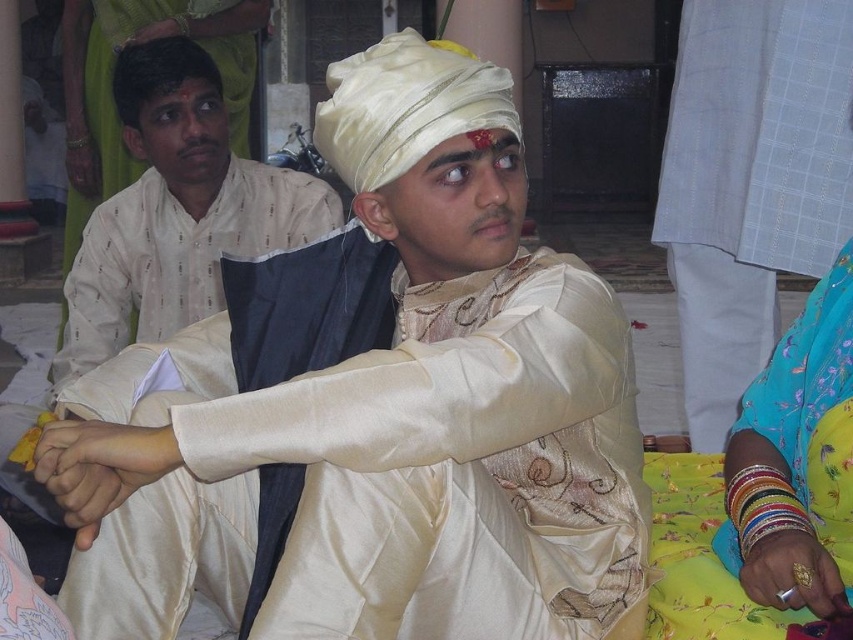
Which of these two, satin beige turban at center or multicolored bangles at lower right, stands shorter?

A: multicolored bangles at lower right

Does point (460, 236) come closer to viewer compared to point (786, 420)?

Yes, point (460, 236) is closer to viewer.

This screenshot has width=853, height=640. Identify the location of satin beige turban at center. (373, 410).

Does matte beige kurta at left have a lesser width compared to reddish-brown paste at forehead center?

Incorrect, matte beige kurta at left's width is not less than reddish-brown paste at forehead center's.

Is matte beige kurta at left to the left of reddish-brown paste at forehead center from the viewer's perspective?

Yes, matte beige kurta at left is to the left of reddish-brown paste at forehead center.

Describe the element at coordinates (161, 92) in the screenshot. I see `matte beige kurta at left` at that location.

In order to click on matte beige kurta at left in this screenshot , I will do `click(161, 92)`.

Measure the distance from satin beige turban at center to matte beige kurta at left.

satin beige turban at center is 6.45 feet from matte beige kurta at left.

Is satin beige turban at center thinner than matte beige kurta at left?

Incorrect, satin beige turban at center's width is not less than matte beige kurta at left's.

At what (x,y) coordinates should I click in order to perform the action: click on satin beige turban at center. Please return your answer as a coordinate pair (x, y). The width and height of the screenshot is (853, 640). Looking at the image, I should click on (373, 410).